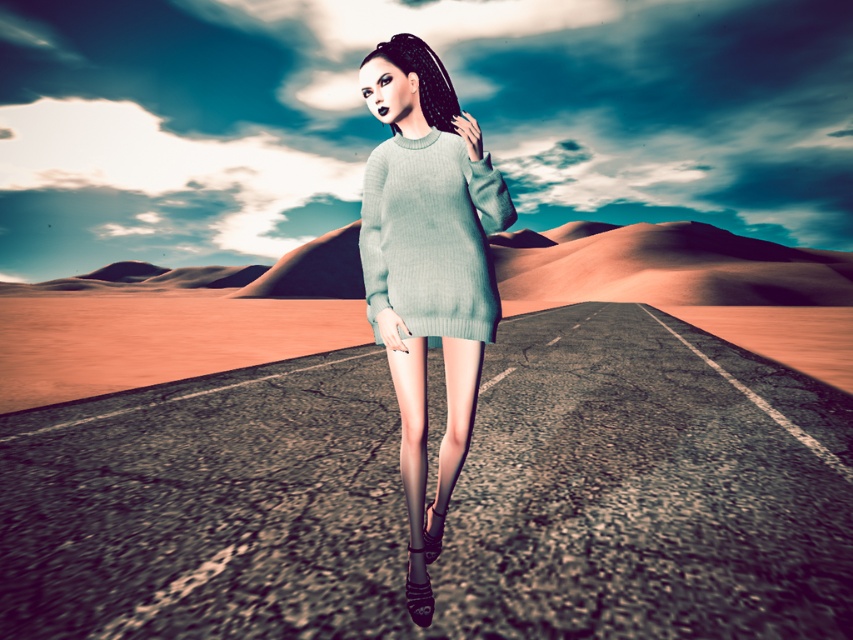
You are an observer looking at the desert scene. You notice two items of clothing labeled as the light blue knitted sweater at center and the light blue knitted dress at center. Which one is positioned lower on the figure?

The light blue knitted sweater at center is located below the light blue knitted dress at center, so the sweater is positioned lower on the figure.

You are standing on the cracked asphalt road in the desert and see two points marked on the road. The first point is at coordinates point (428, 580) and the second point is at point (404, 284). Which point is closer to you?

Point (428, 580) is closer to the viewer than point (404, 284).

You are a fashion designer observing the figure in the desert scene. You need to determine which item of clothing is narrower between the light blue knitted sweater at center and the light blue knitted dress at center. Which one is narrower?

The light blue knitted sweater at center is narrower than the light blue knitted dress at center according to the description.